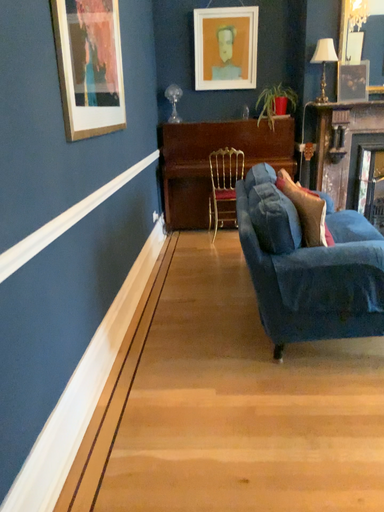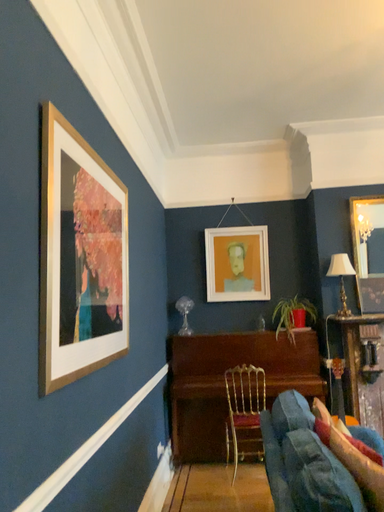
Question: Which way did the camera rotate in the video?

Choices:
 (A) rotated downward
 (B) rotated upward

Answer: (B)